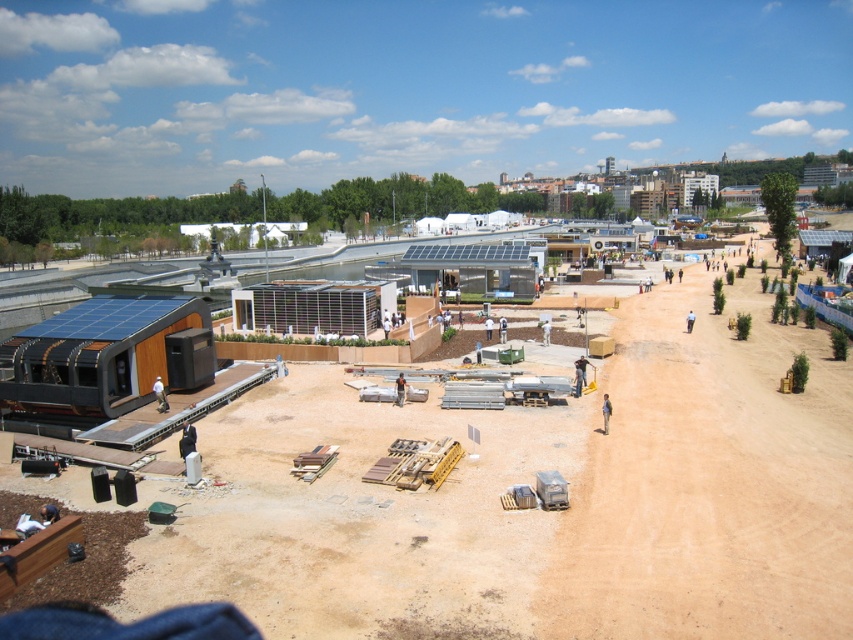
You are a construction worker standing at the point marked by the coordinates (538, 509). You need to move to the curved roof building with solar panels on the left. Is the path clear between your current position and the building?

The path between the brown wooden construction site at center and the curved roof building with solar panels on the left is clear, so yes, the path is clear.

From the picture: You are a delivery driver arriving at the construction site. Your truck is 2 meters tall. The brown wooden construction site at center and the brown dirt track at center are in your path. Which object might block your truck from passing through?

The brown wooden construction site at center is not as tall as the brown dirt track at center, so the brown dirt track at center is taller and might block the truck.

You are a delivery driver who has to navigate through the construction site. You see the brown wooden construction site at center and the brown dirt track at center. Which one is closer to you?

The brown wooden construction site at center is closer to the viewer than the brown dirt track at center, so the brown wooden construction site at center is closer to you.